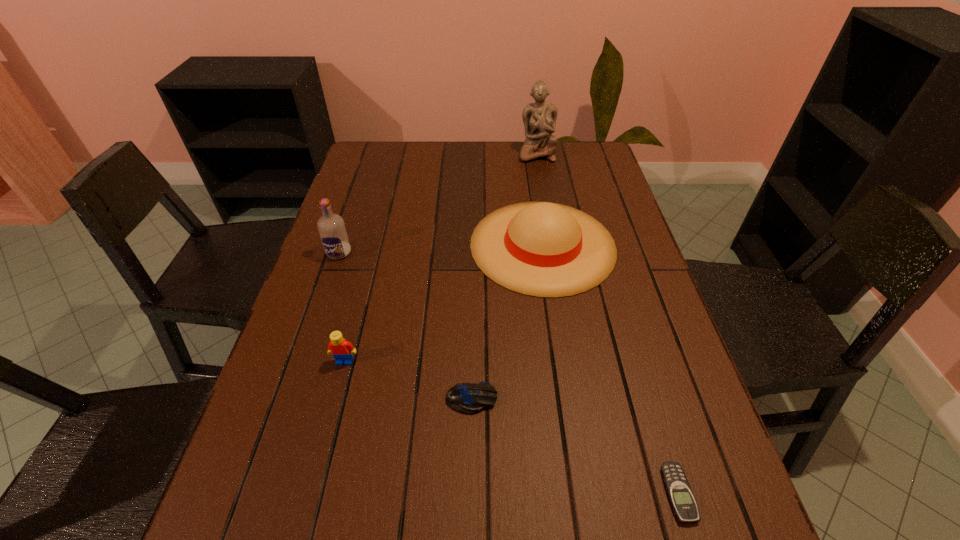
At what (x,y) coordinates should I click in order to perform the action: click on the tallest object. Please return your answer as a coordinate pair (x, y). This screenshot has width=960, height=540. Looking at the image, I should click on (539, 118).

Where is `figurine`? This screenshot has width=960, height=540. figurine is located at coordinates (539, 118).

The height and width of the screenshot is (540, 960). Identify the location of the leftmost object. (332, 231).

The height and width of the screenshot is (540, 960). In order to click on the fifth shortest object in this screenshot , I will do `click(332, 231)`.

This screenshot has width=960, height=540. I want to click on the fourth shortest object, so click(543, 249).

In order to click on Lego in this screenshot , I will do `click(341, 350)`.

Identify the location of the third shortest object. (341, 350).

Locate an element on the screen. This screenshot has width=960, height=540. the second nearest object is located at coordinates (467, 398).

The image size is (960, 540). In order to click on computer mouse in this screenshot , I will do `click(467, 398)`.

This screenshot has width=960, height=540. What are the coordinates of `the nearest object` in the screenshot? It's located at (679, 492).